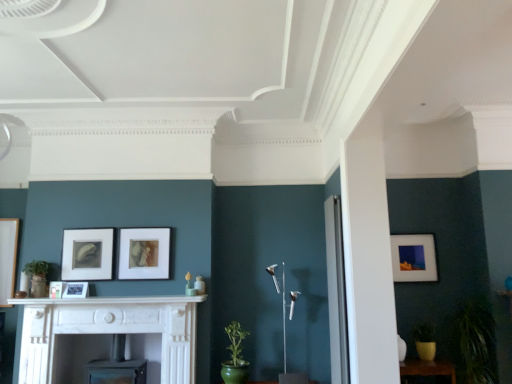
Question: Does wooden table at lower right turn towards matte black picture frame at center, marked as the fifth picture frame in a back-to-front arrangement?

Choices:
 (A) yes
 (B) no

Answer: (B)

Question: From the image's perspective, would you say wooden table at lower right is positioned over matte black picture frame at center, placed as the 1th picture frame when sorted from front to back?

Choices:
 (A) yes
 (B) no

Answer: (B)

Question: From a real-world perspective, is wooden table at lower right below matte black picture frame at center, placed as the 1th picture frame when sorted from front to back?

Choices:
 (A) yes
 (B) no

Answer: (A)

Question: Can you confirm if wooden table at lower right is shorter than matte black picture frame at center, placed as the 1th picture frame when sorted from front to back?

Choices:
 (A) no
 (B) yes

Answer: (A)

Question: Is wooden table at lower right to the left of matte black picture frame at center, positioned as the first picture frame in left-to-right order, from the viewer's perspective?

Choices:
 (A) yes
 (B) no

Answer: (B)

Question: Is matte black picture frame at center, positioned as the first picture frame in left-to-right order, located within wooden table at lower right?

Choices:
 (A) no
 (B) yes

Answer: (A)

Question: Is green matte plant at lower right, the second plant from the left, not within green glazed pot at lower center, marked as the 2th plant in a right-to-left arrangement?

Choices:
 (A) yes
 (B) no

Answer: (A)

Question: Is green matte plant at lower right, the second plant from the left, wider than green glazed pot at lower center, placed as the 1th plant when sorted from left to right?

Choices:
 (A) yes
 (B) no

Answer: (A)

Question: From a real-world perspective, does green matte plant at lower right, the second plant from the left, sit lower than green glazed pot at lower center, marked as the 2th plant in a right-to-left arrangement?

Choices:
 (A) no
 (B) yes

Answer: (A)

Question: Is green matte plant at lower right, which ranks as the 1th plant in right-to-left order, closer to camera compared to green glazed pot at lower center, marked as the 2th plant in a right-to-left arrangement?

Choices:
 (A) yes
 (B) no

Answer: (A)

Question: Is green matte plant at lower right, the second plant from the left, turned away from green glazed pot at lower center, placed as the 1th plant when sorted from left to right?

Choices:
 (A) yes
 (B) no

Answer: (B)

Question: From a real-world perspective, is green matte plant at lower right, which ranks as the 1th plant in right-to-left order, on green glazed pot at lower center, placed as the 1th plant when sorted from left to right?

Choices:
 (A) yes
 (B) no

Answer: (A)

Question: Can you confirm if matte black picture frame at center, placed as the 1th picture frame when sorted from front to back, is taller than matte white picture frame at right, positioned as the 1th picture frame in back-to-front order?

Choices:
 (A) yes
 (B) no

Answer: (B)